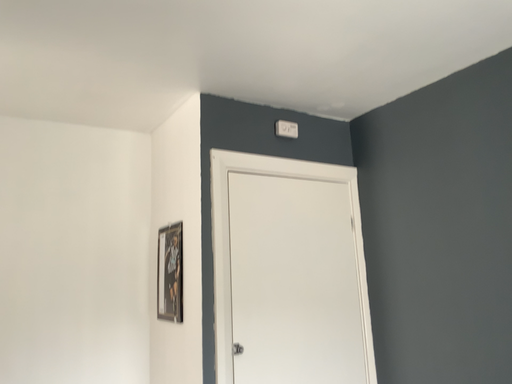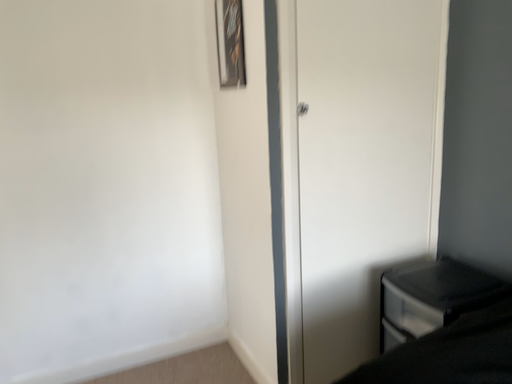
Question: How did the camera likely rotate when shooting the video?

Choices:
 (A) rotated left
 (B) rotated right

Answer: (A)